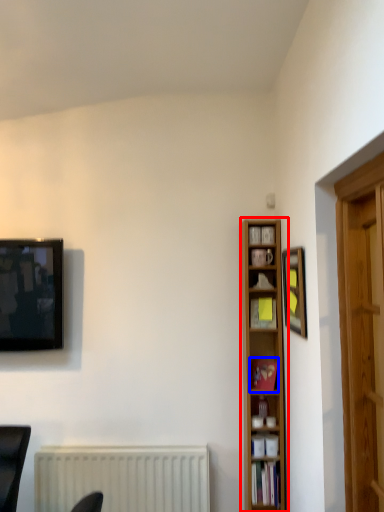
Question: Which object appears farthest to the camera in this image, bookcase (highlighted by a red box) or book (highlighted by a blue box)?

Choices:
 (A) bookcase
 (B) book

Answer: (B)